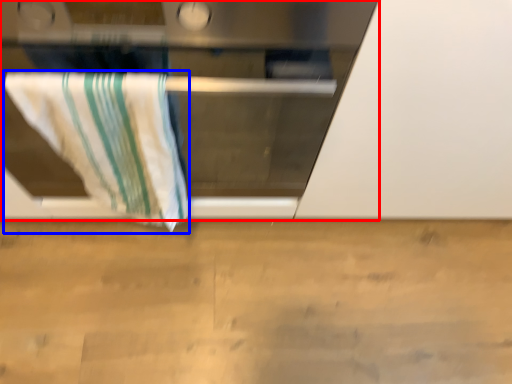
Question: Which point is further to the camera, oven (highlighted by a red box) or towel (highlighted by a blue box)?

Choices:
 (A) oven
 (B) towel

Answer: (B)